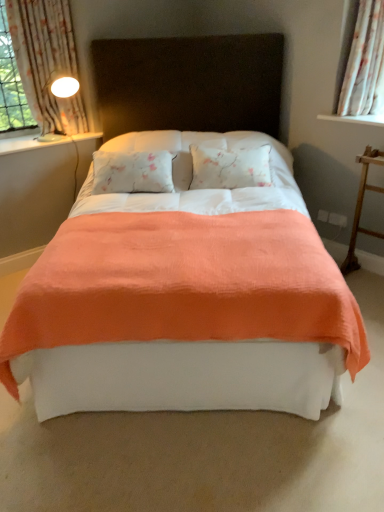
Question: Considering their positions, is white floral fabric curtain at upper right, which is the first curtain in right-to-left order, located in front of or behind white glossy lamp at upper left?

Choices:
 (A) behind
 (B) front

Answer: (B)

Question: From a real-world perspective, relative to white glossy lamp at upper left, is white floral fabric curtain at upper right, which is the first curtain in right-to-left order, vertically above or below?

Choices:
 (A) above
 (B) below

Answer: (A)

Question: Based on their relative distances, which object is farther from the coral fabric bed at center?

Choices:
 (A) floral fabric curtain at left, which is counted as the second curtain, starting from the right
 (B) wooden ladder at right
 (C) white glossy window sill at left
 (D) white floral fabric curtain at upper right, which is the second curtain from left to right
 (E) white glossy lamp at upper left

Answer: (E)

Question: Which is nearer to the white floral fabric curtain at upper right, which is the second curtain from left to right?

Choices:
 (A) white glossy lamp at upper left
 (B) floral fabric curtain at left, which is counted as the first curtain, starting from the left
 (C) wooden ladder at right
 (D) white glossy window sill at left
 (E) coral fabric bed at center

Answer: (C)